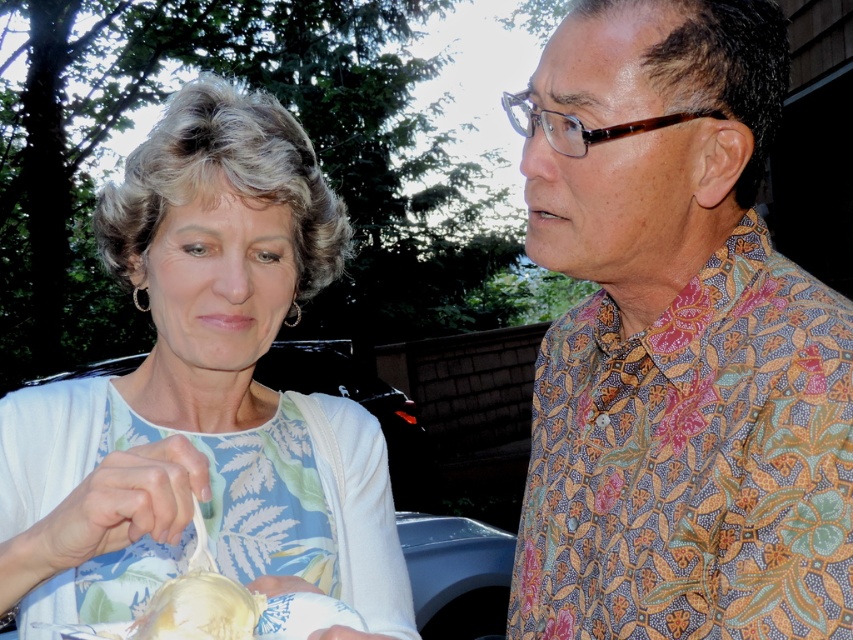
Question: Which of the following is the closest to the observer?

Choices:
 (A) white floral dress at center
 (B) floral-patterned shirt at right
 (C) white glossy bowl at lower left

Answer: (C)

Question: Does floral-patterned shirt at right appear over white floral dress at center?

Choices:
 (A) yes
 (B) no

Answer: (B)

Question: Does white floral dress at center have a smaller size compared to white glossy bowl at lower left?

Choices:
 (A) yes
 (B) no

Answer: (B)

Question: Does floral-patterned shirt at right come in front of white floral dress at center?

Choices:
 (A) no
 (B) yes

Answer: (A)

Question: Among these objects, which one is farthest from the camera?

Choices:
 (A) white glossy bowl at lower left
 (B) white floral dress at center

Answer: (B)

Question: Which object appears farthest from the camera in this image?

Choices:
 (A) white glossy bowl at lower left
 (B) floral-patterned shirt at right

Answer: (B)